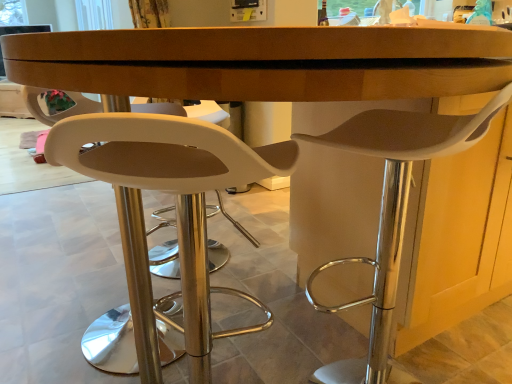
The image size is (512, 384). Identify the location of white plastic stool at right, the 1th chair viewed from the right. tap(392, 211).

Describe the element at coordinates (392, 211) in the screenshot. I see `white plastic stool at right, the 1th chair viewed from the right` at that location.

Looking at this image, what is the approximate height of white plastic stool at right, which ranks as the second chair in left-to-right order?

It is 28.02 inches.

You are a GUI agent. You are given a task and a screenshot of the screen. Output one action in this format:
    pyautogui.click(x=<x>, y=<y>)
    Task: Click on the white plastic chair at center, placed as the 2th chair when sorted from back to front
    This screenshot has height=384, width=512.
    Given the screenshot: What is the action you would take?
    pyautogui.click(x=170, y=192)

What do you see at coordinates (170, 192) in the screenshot?
I see `white plastic chair at center, acting as the 1th chair starting from the front` at bounding box center [170, 192].

Identify the location of white plastic stool at right, which ranks as the second chair in left-to-right order. (392, 211).

Is white plastic stool at right, the first chair from the back, to the left of white plastic chair at center, which is counted as the first chair, starting from the left, from the viewer's perspective?

No, white plastic stool at right, the first chair from the back, is not to the left of white plastic chair at center, which is counted as the first chair, starting from the left.

Which object is further away from the camera, white plastic stool at right, the first chair from the back, or white plastic chair at center, which is counted as the first chair, starting from the left?

white plastic stool at right, the first chair from the back, is further away from the camera.

Which is closer to the camera, (x=372, y=127) or (x=64, y=163)?

Point (x=64, y=163)

From the image's perspective, is white plastic stool at right, the 1th chair viewed from the right, beneath white plastic chair at center, which is counted as the first chair, starting from the left?

No, from the image's perspective, white plastic stool at right, the 1th chair viewed from the right, is not below white plastic chair at center, which is counted as the first chair, starting from the left.

From a real-world perspective, does white plastic stool at right, the first chair from the back, stand above white plastic chair at center, acting as the 1th chair starting from the front?

No.

Does white plastic stool at right, the second chair viewed from the front, have a greater width compared to white plastic chair at center, placed as the 2th chair when sorted from back to front?

Yes, white plastic stool at right, the second chair viewed from the front, is wider than white plastic chair at center, placed as the 2th chair when sorted from back to front.

Considering the relative sizes of white plastic stool at right, the second chair viewed from the front, and white plastic chair at center, which is counted as the first chair, starting from the left, in the image provided, is white plastic stool at right, the second chair viewed from the front, taller than white plastic chair at center, which is counted as the first chair, starting from the left,?

In fact, white plastic stool at right, the second chair viewed from the front, may be shorter than white plastic chair at center, which is counted as the first chair, starting from the left.

Which of these two, white plastic stool at right, the second chair viewed from the front, or white plastic chair at center, acting as the 1th chair starting from the front, is bigger?

white plastic stool at right, the second chair viewed from the front.

Would you say white plastic stool at right, the 1th chair viewed from the right, is outside white plastic chair at center, which is counted as the first chair, starting from the left?

Indeed, white plastic stool at right, the 1th chair viewed from the right, is completely outside white plastic chair at center, which is counted as the first chair, starting from the left.

Are white plastic stool at right, the second chair viewed from the front, and white plastic chair at center, marked as the second chair in a right-to-left arrangement, located far from each other?

That's not correct — white plastic stool at right, the second chair viewed from the front, is a little close to white plastic chair at center, marked as the second chair in a right-to-left arrangement.

Is white plastic stool at right, the first chair from the back, aimed at white plastic chair at center, placed as the 2th chair when sorted from back to front?

No, white plastic stool at right, the first chair from the back, is not facing towards white plastic chair at center, placed as the 2th chair when sorted from back to front.

Can you tell me how much white plastic stool at right, the first chair from the back, and white plastic chair at center, which is counted as the first chair, starting from the left, differ in facing direction?

white plastic stool at right, the first chair from the back, and white plastic chair at center, which is counted as the first chair, starting from the left, are facing 43.1 degrees away from each other.

This screenshot has height=384, width=512. What are the coordinates of `chair lying above the white plastic chair at center, placed as the 2th chair when sorted from back to front (from the image's perspective)` in the screenshot? It's located at (392, 211).

Can you confirm if white plastic chair at center, marked as the second chair in a right-to-left arrangement, is positioned to the left of white plastic stool at right, the second chair viewed from the front?

Correct, you'll find white plastic chair at center, marked as the second chair in a right-to-left arrangement, to the left of white plastic stool at right, the second chair viewed from the front.

Does white plastic chair at center, acting as the 1th chair starting from the front, come behind white plastic stool at right, the first chair from the back?

No, it is in front of white plastic stool at right, the first chair from the back.

Is point (150, 135) farther from viewer compared to point (372, 299)?

That is False.

Based on the photo, from the image's perspective, between white plastic chair at center, placed as the 2th chair when sorted from back to front, and white plastic stool at right, the second chair viewed from the front, who is located below?

white plastic chair at center, placed as the 2th chair when sorted from back to front, appears lower in the image.

From a real-world perspective, is white plastic chair at center, which is counted as the first chair, starting from the left, located higher than white plastic stool at right, the first chair from the back?

Yes, from a real-world perspective, white plastic chair at center, which is counted as the first chair, starting from the left, is over white plastic stool at right, the first chair from the back

Can you confirm if white plastic chair at center, placed as the 2th chair when sorted from back to front, is wider than white plastic stool at right, the first chair from the back?

No, white plastic chair at center, placed as the 2th chair when sorted from back to front, is not wider than white plastic stool at right, the first chair from the back.

Considering the sizes of white plastic chair at center, acting as the 1th chair starting from the front, and white plastic stool at right, the 1th chair viewed from the right, in the image, is white plastic chair at center, acting as the 1th chair starting from the front, taller or shorter than white plastic stool at right, the 1th chair viewed from the right,?

white plastic chair at center, acting as the 1th chair starting from the front, is taller than white plastic stool at right, the 1th chair viewed from the right.

Considering the relative sizes of white plastic chair at center, marked as the second chair in a right-to-left arrangement, and white plastic stool at right, the first chair from the back, in the image provided, is white plastic chair at center, marked as the second chair in a right-to-left arrangement, bigger than white plastic stool at right, the first chair from the back,?

Actually, white plastic chair at center, marked as the second chair in a right-to-left arrangement, might be smaller than white plastic stool at right, the first chair from the back.

Is white plastic stool at right, the second chair viewed from the front, inside white plastic chair at center, acting as the 1th chair starting from the front?

That's incorrect, white plastic stool at right, the second chair viewed from the front, is not inside white plastic chair at center, acting as the 1th chair starting from the front.

Is white plastic chair at center, marked as the second chair in a right-to-left arrangement, next to white plastic stool at right, the first chair from the back, and touching it?

No, white plastic chair at center, marked as the second chair in a right-to-left arrangement, is not touching white plastic stool at right, the first chair from the back.

Looking at this image, could you tell me if white plastic chair at center, marked as the second chair in a right-to-left arrangement, is facing white plastic stool at right, the second chair viewed from the front?

No.

How many degrees apart are the facing directions of white plastic chair at center, placed as the 2th chair when sorted from back to front, and white plastic stool at right, which ranks as the second chair in left-to-right order?

43.1 degrees separate the facing orientations of white plastic chair at center, placed as the 2th chair when sorted from back to front, and white plastic stool at right, which ranks as the second chair in left-to-right order.

Find the location of a particular element. The image size is (512, 384). chair that appears in front of the white plastic stool at right, the 1th chair viewed from the right is located at coordinates click(170, 192).

At what (x,y) coordinates should I click in order to perform the action: click on chair that appears above the white plastic stool at right, which ranks as the second chair in left-to-right order (from a real-world perspective). Please return your answer as a coordinate pair (x, y). Looking at the image, I should click on (170, 192).

Locate an element on the screen. chair lying behind the white plastic chair at center, placed as the 2th chair when sorted from back to front is located at coordinates (392, 211).